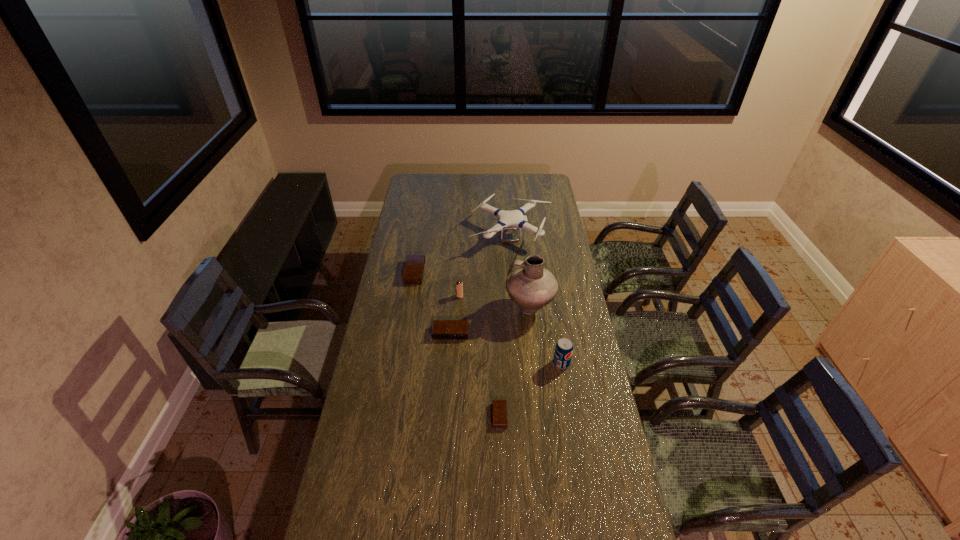
Identify the location of vacant position located 0.140m on the back of the fourth tallest object. This screenshot has height=540, width=960. (461, 274).

Where is `object located in the left edge section of the desktop`? This screenshot has width=960, height=540. object located in the left edge section of the desktop is located at coordinates (413, 272).

At what (x,y) coordinates should I click in order to perform the action: click on drone positioned at the right edge. Please return your answer as a coordinate pair (x, y). Image resolution: width=960 pixels, height=540 pixels. Looking at the image, I should click on (516, 217).

I want to click on pop that is positioned at the right edge, so click(x=564, y=348).

In order to click on pitcher situated at the right edge in this screenshot , I will do `click(530, 286)`.

Find the location of a particular element. This screenshot has height=540, width=960. free region at the far edge of the desktop is located at coordinates (457, 193).

Find the location of a particular element. This screenshot has width=960, height=540. vacant space at the near edge of the desktop is located at coordinates click(x=456, y=525).

Locate an element on the screen. The height and width of the screenshot is (540, 960). vacant region at the left edge is located at coordinates (392, 448).

The image size is (960, 540). Find the location of `free space at the right edge`. free space at the right edge is located at coordinates (599, 458).

Where is `vacant space at the far right corner`? vacant space at the far right corner is located at coordinates (534, 179).